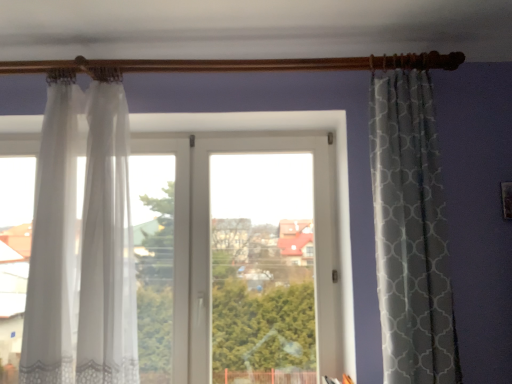
Question: Is point (44, 230) closer or farther from the camera than point (27, 370)?

Choices:
 (A) closer
 (B) farther

Answer: (B)

Question: From the image's perspective, is white sheer curtain at left, marked as the second curtain in a left-to-right arrangement, positioned above or below sheer white curtain at left, positioned as the 2th curtain in right-to-left order?

Choices:
 (A) above
 (B) below

Answer: (B)

Question: Estimate the real-world distances between objects in this image. Which object is closer to the sheer white curtain at left, positioned as the 2th curtain in right-to-left order?

Choices:
 (A) transparent fabric window at center
 (B) white sheer curtain at left, which is counted as the first curtain, starting from the right

Answer: (B)

Question: Which object is positioned closest to the transparent fabric window at center?

Choices:
 (A) white sheer curtain at left, which is counted as the first curtain, starting from the right
 (B) sheer white curtain at left, positioned as the 2th curtain in right-to-left order

Answer: (A)